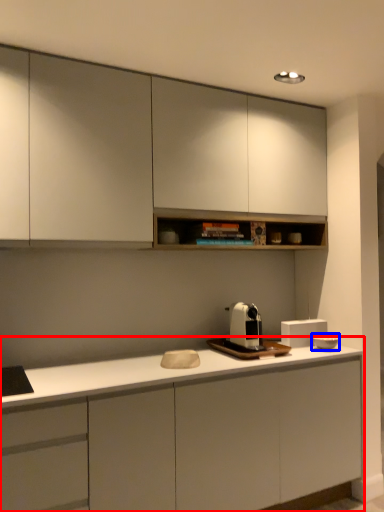
Question: Which object appears farthest to the camera in this image, cabinetry (highlighted by a red box) or appliance (highlighted by a blue box)?

Choices:
 (A) cabinetry
 (B) appliance

Answer: (B)